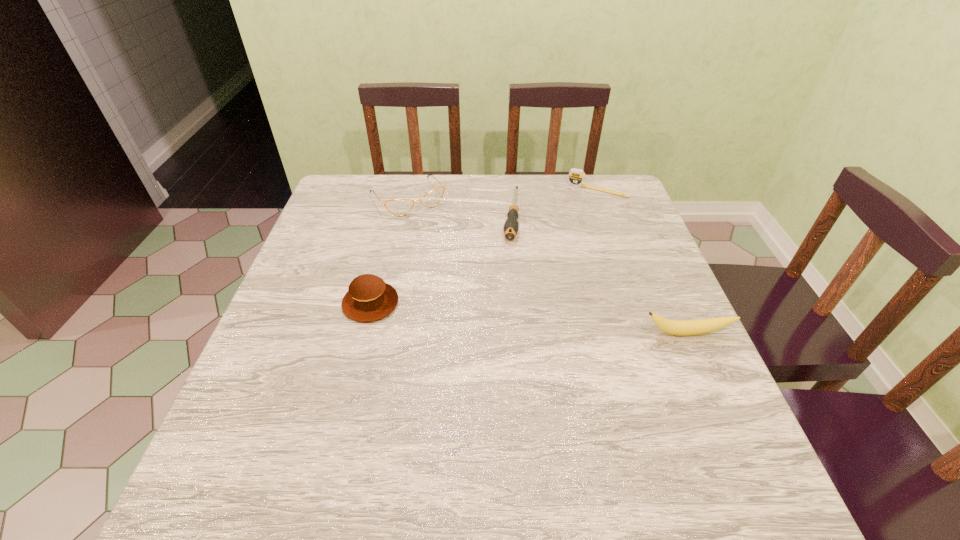
Identify the location of free space located at the tip of the screwdriver. Image resolution: width=960 pixels, height=540 pixels. (505, 297).

In order to click on vacant space located 0.250m on the front-facing side of the spectacles in this screenshot , I will do `click(463, 268)`.

Image resolution: width=960 pixels, height=540 pixels. Identify the location of free space located on the front-facing side of the spectacles. (459, 264).

Locate an element on the screen. The image size is (960, 540). free region located on the front-facing side of the spectacles is located at coordinates (447, 248).

This screenshot has width=960, height=540. Identify the location of free space located 0.120m at the front of the tape measure with the tape extended. (577, 219).

Image resolution: width=960 pixels, height=540 pixels. Find the location of `vacant space located 0.090m at the front of the tape measure with the tape extended`. vacant space located 0.090m at the front of the tape measure with the tape extended is located at coordinates (580, 213).

You are a GUI agent. You are given a task and a screenshot of the screen. Output one action in this format:
    pyautogui.click(x=<x>, y=<y>)
    Task: Click on the free space located at the front of the tape measure with the tape extended
    The image size is (960, 540).
    Given the screenshot: What is the action you would take?
    pyautogui.click(x=545, y=278)

Where is `screwdriver that is at the far edge`? screwdriver that is at the far edge is located at coordinates (511, 226).

Identify the location of spectacles located in the far edge section of the desktop. This screenshot has width=960, height=540. (399, 207).

What are the coordinates of `tape measure that is at the far edge` in the screenshot? It's located at (576, 177).